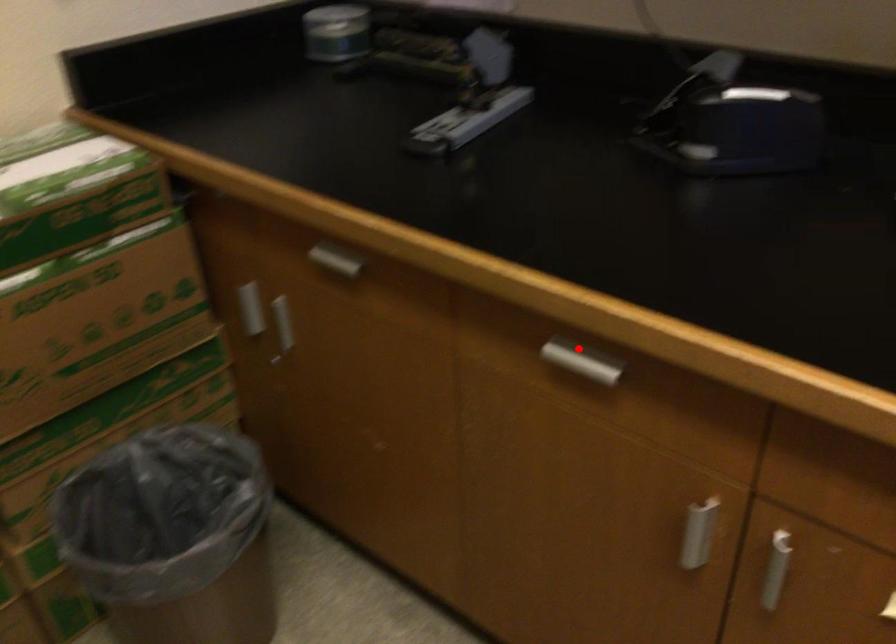
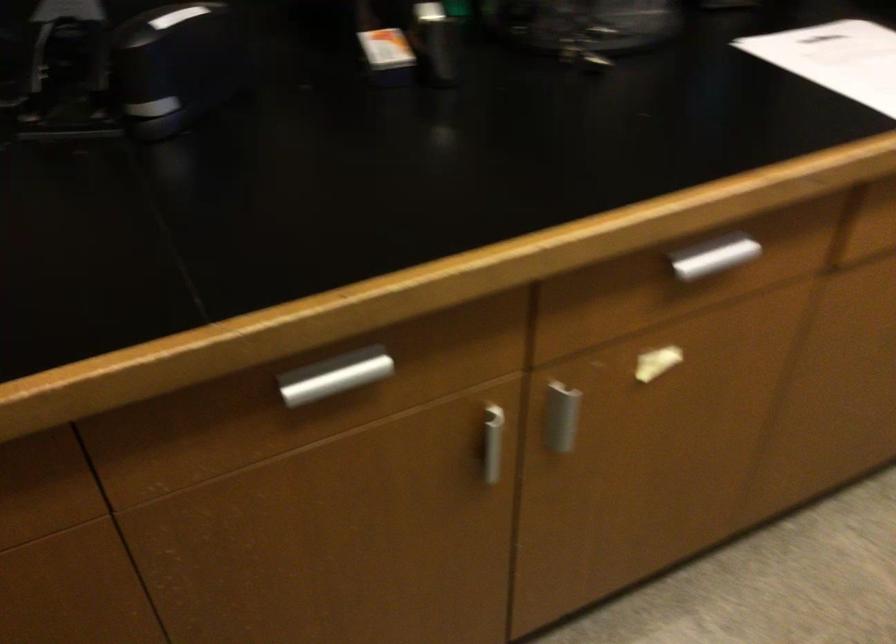
Question: I am providing you with two images of the same scene from different viewpoints. In image1, a red point is highlighted. Considering the same 3D point in image2, which of the following is correct?

Choices:
 (A) It is closer
 (B) It is farther

Answer: (A)